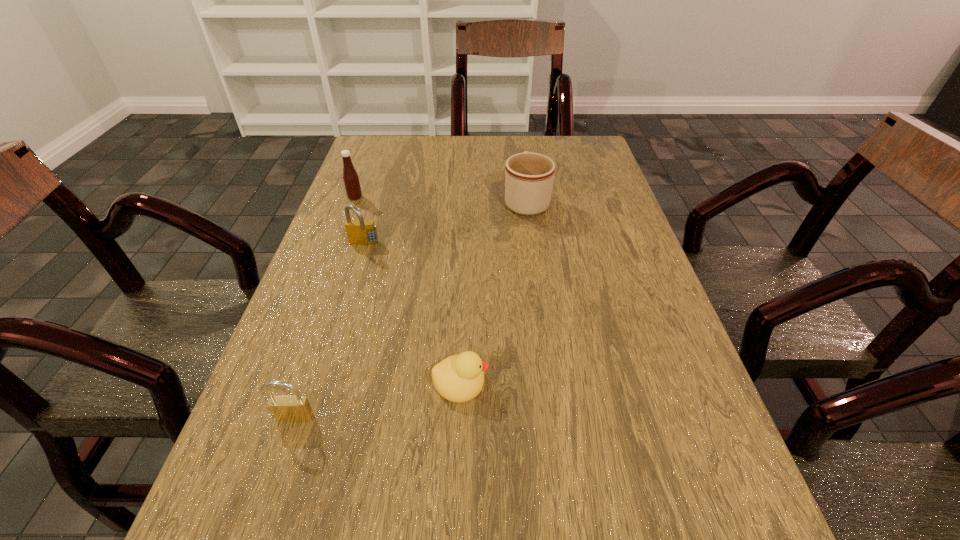
I want to click on Tabasco sauce, so click(x=351, y=180).

Locate an element on the screen. This screenshot has width=960, height=540. mug is located at coordinates (529, 176).

At what (x,y) coordinates should I click in order to perform the action: click on the third farthest object. Please return your answer as a coordinate pair (x, y). The height and width of the screenshot is (540, 960). Looking at the image, I should click on (360, 232).

The image size is (960, 540). I want to click on the nearest object, so [x=296, y=408].

Locate an element on the screen. Image resolution: width=960 pixels, height=540 pixels. duckling is located at coordinates (459, 378).

At what (x,y) coordinates should I click in order to perform the action: click on the shortest object. Please return your answer as a coordinate pair (x, y). The image size is (960, 540). Looking at the image, I should click on (459, 378).

Image resolution: width=960 pixels, height=540 pixels. In order to click on vacant space located 0.240m on the right of the Tabasco sauce in this screenshot , I will do `click(453, 198)`.

Where is `vacant space situated 0.150m on the side of the rightmost object with the handle`? vacant space situated 0.150m on the side of the rightmost object with the handle is located at coordinates (520, 159).

The width and height of the screenshot is (960, 540). Find the location of `vacant space situated 0.200m on the side of the rightmost object with the handle`. vacant space situated 0.200m on the side of the rightmost object with the handle is located at coordinates (519, 151).

Where is `free space located on the side of the rightmost object with the handle`? free space located on the side of the rightmost object with the handle is located at coordinates (522, 170).